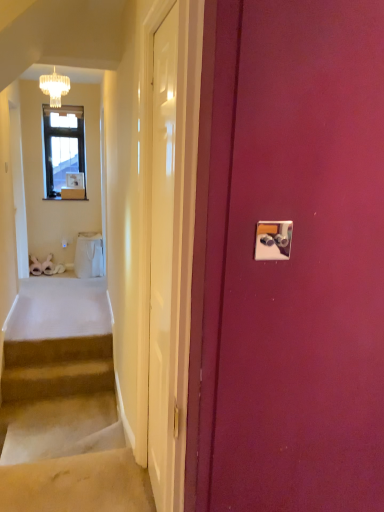
Question: Does white glossy door at center, acting as the second door starting from the right, have a lesser height compared to beige carpeted stairs at lower left, which ranks as the second stairs in top-to-bottom order?

Choices:
 (A) yes
 (B) no

Answer: (B)

Question: Considering the relative sizes of white glossy door at center, the 1th door positioned from the left, and beige carpeted stairs at lower left, which is counted as the first stairs, starting from the bottom, in the image provided, is white glossy door at center, the 1th door positioned from the left, smaller than beige carpeted stairs at lower left, which is counted as the first stairs, starting from the bottom,?

Choices:
 (A) no
 (B) yes

Answer: (B)

Question: Is white glossy door at center, acting as the second door starting from the right, outside of beige carpeted stairs at lower left, which ranks as the second stairs in top-to-bottom order?

Choices:
 (A) no
 (B) yes

Answer: (B)

Question: Is white glossy door at center, acting as the second door starting from the right, oriented towards beige carpeted stairs at lower left, which is counted as the first stairs, starting from the bottom?

Choices:
 (A) yes
 (B) no

Answer: (B)

Question: Is white glossy door at center, the 1th door positioned from the left, to the left of beige carpeted stairs at lower left, which ranks as the second stairs in top-to-bottom order, from the viewer's perspective?

Choices:
 (A) no
 (B) yes

Answer: (A)

Question: Is white glossy door at center, acting as the second door starting from the right, wider or thinner than crystal glass chandelier at upper left?

Choices:
 (A) thin
 (B) wide

Answer: (A)

Question: From a real-world perspective, is white glossy door at center, the 1th door positioned from the left, positioned above or below crystal glass chandelier at upper left?

Choices:
 (A) below
 (B) above

Answer: (A)

Question: Is white glossy door at center, acting as the second door starting from the right, taller or shorter than crystal glass chandelier at upper left?

Choices:
 (A) tall
 (B) short

Answer: (A)

Question: From the image's perspective, is white glossy door at center, the 1th door positioned from the left, above or below crystal glass chandelier at upper left?

Choices:
 (A) below
 (B) above

Answer: (A)

Question: In the image, is metallic silver light switch at upper right positioned in front of or behind beige carpeted stairs at lower left, which ranks as the second stairs in top-to-bottom order?

Choices:
 (A) front
 (B) behind

Answer: (A)

Question: Looking at their shapes, would you say metallic silver light switch at upper right is wider or thinner than beige carpeted stairs at lower left, which ranks as the second stairs in top-to-bottom order?

Choices:
 (A) wide
 (B) thin

Answer: (B)

Question: Choose the correct answer: Is metallic silver light switch at upper right inside beige carpeted stairs at lower left, which is counted as the first stairs, starting from the bottom, or outside it?

Choices:
 (A) inside
 (B) outside

Answer: (B)

Question: From their relative heights in the image, would you say metallic silver light switch at upper right is taller or shorter than beige carpeted stairs at lower left, which ranks as the second stairs in top-to-bottom order?

Choices:
 (A) tall
 (B) short

Answer: (B)

Question: Is beige carpeted stairs at lower left, which ranks as the second stairs in top-to-bottom order, inside or outside of white glossy box at upper left?

Choices:
 (A) inside
 (B) outside

Answer: (B)

Question: From the image's perspective, is beige carpeted stairs at lower left, which ranks as the second stairs in top-to-bottom order, located above or below white glossy box at upper left?

Choices:
 (A) below
 (B) above

Answer: (A)